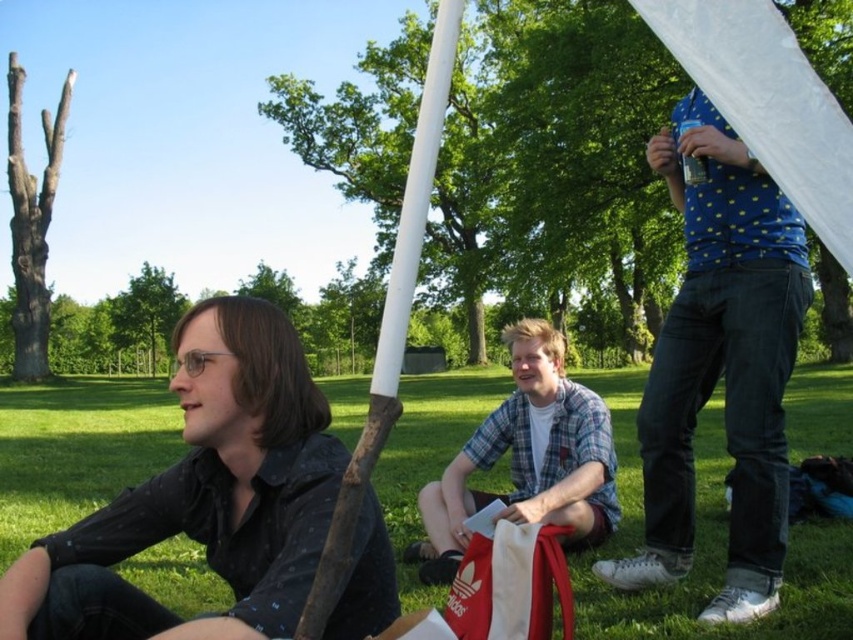
What is located at the coordinate point (705, 547) in the image?

The point (705, 547) corresponds to green grass at lower center.